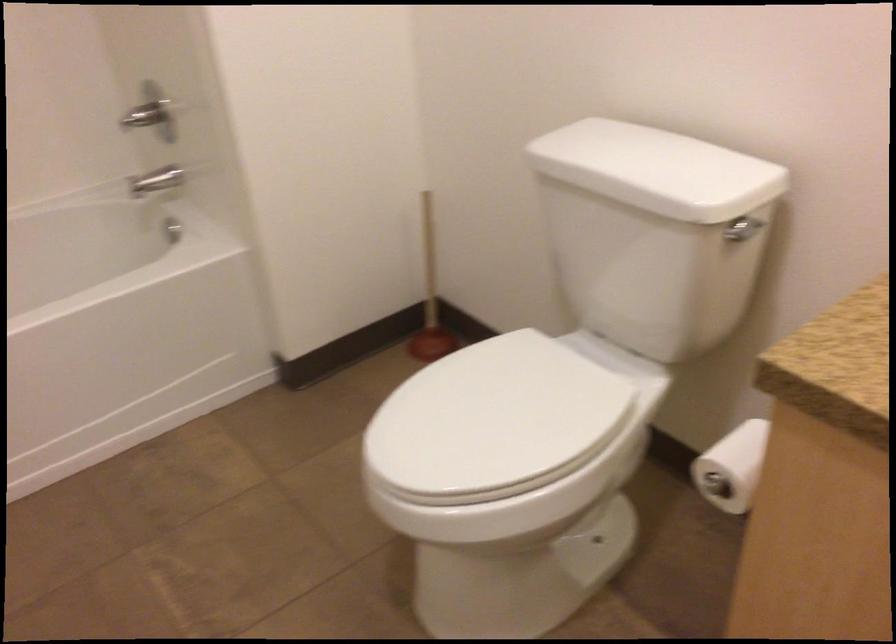
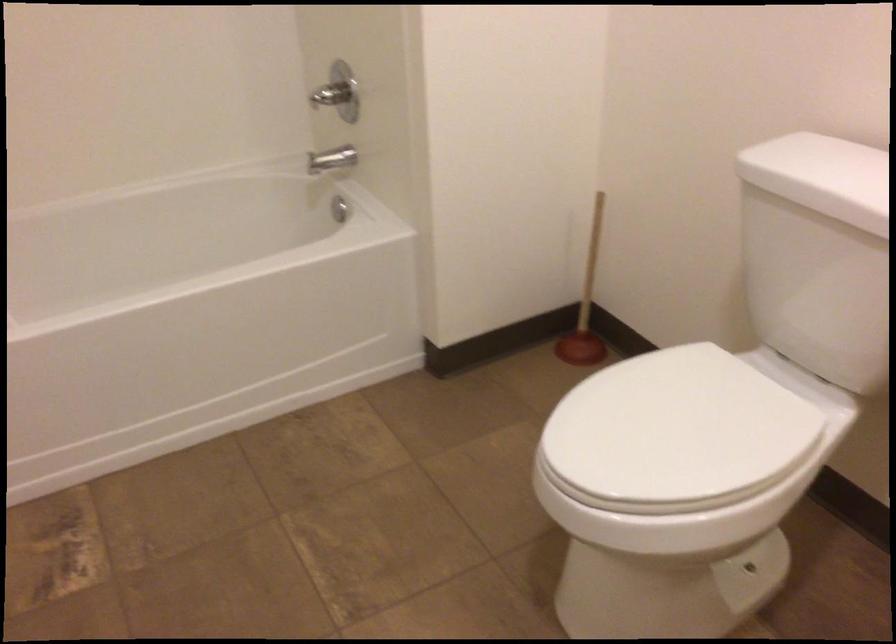
Where in the second image is the point corresponding to (493,422) from the first image?

(675, 431)